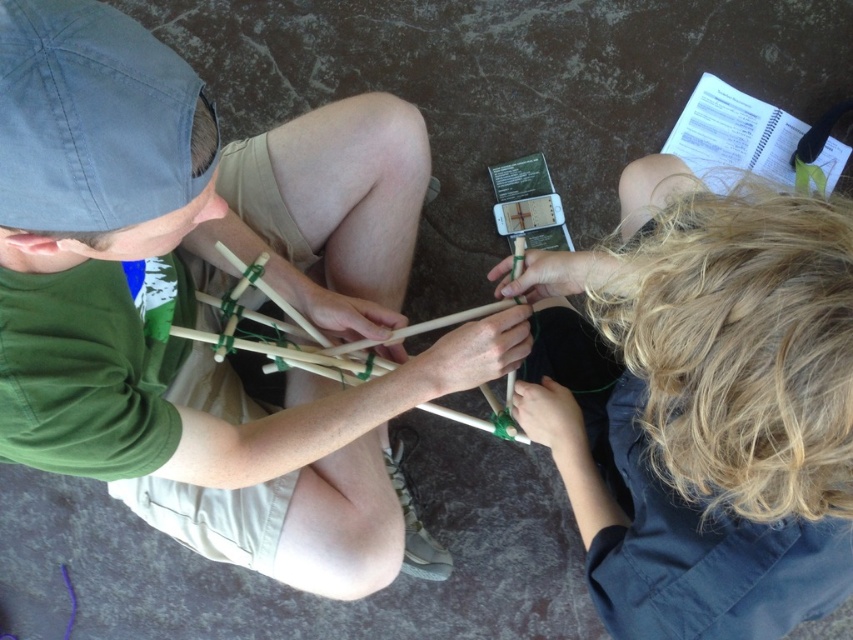
You are a photographer trying to capture a closeup of the smooth wooden sticks at center and the blonde hair at upper right. Since you want both to be in focus, which object should you adjust your camera focus to prioritize based on their sizes?

The smooth wooden sticks at center is larger in size than blonde hair at upper right, so you should prioritize focusing on the smooth wooden sticks at center to ensure both are in focus.

From the picture: You are a photographer trying to capture a closeup of the smooth wooden sticks at center without the blonde hair at upper right appearing in the frame. Is this possible based on their positions?

Yes, since the smooth wooden sticks at center is in front of the blonde hair at upper right, you can adjust your angle to focus on the sticks while blocking the hair from view.

You are a robot with a camera that has a field of view of 30 degrees. You are positioned such that you can see both the smooth wooden sticks at center and the blonde hair at upper right. If the distance between these two objects is 36.58 centimeters, can your camera capture both objects in a single frame without moving?

The distance between the smooth wooden sticks at center and the blonde hair at upper right is 36.58 centimeters. Since the camera has a 30 degree field of view, it depends on the camera sensor size and focal length. Without knowing those specifics, it is impossible to determine if both objects can be captured in a single frame.